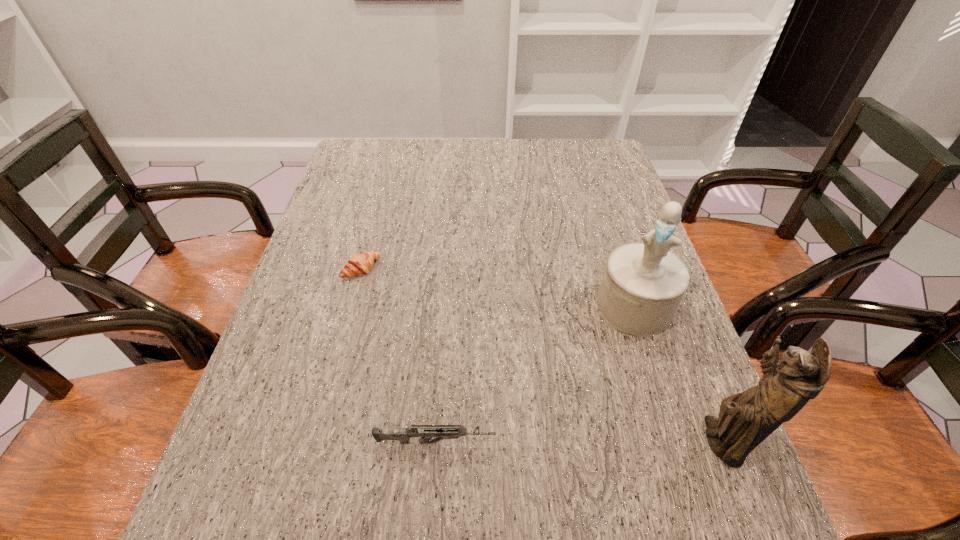
Where is `the third object from right to left`? the third object from right to left is located at coordinates (425, 432).

Identify the location of the second shortest object. The width and height of the screenshot is (960, 540). (425, 432).

Identify the location of the nearer figurine. (745, 419).

The image size is (960, 540). What are the coordinates of `the farther figurine` in the screenshot? It's located at (643, 284).

Locate an element on the screen. The width and height of the screenshot is (960, 540). pastry is located at coordinates (358, 265).

Identify the location of the leftmost object. (358, 265).

You are a GUI agent. You are given a task and a screenshot of the screen. Output one action in this format:
    pyautogui.click(x=<x>, y=<y>)
    Task: Click on the vacant space located aimed along the barrel of the second shortest object
    This screenshot has height=540, width=960.
    Given the screenshot: What is the action you would take?
    pyautogui.click(x=655, y=442)

This screenshot has height=540, width=960. Find the location of `free point located 0.280m on the front-facing side of the nearer figurine`. free point located 0.280m on the front-facing side of the nearer figurine is located at coordinates (534, 441).

Where is `vacant space situated 0.080m on the front-facing side of the nearer figurine`? vacant space situated 0.080m on the front-facing side of the nearer figurine is located at coordinates (643, 441).

Find the location of a particular element. This screenshot has height=540, width=960. free space located on the front-facing side of the nearer figurine is located at coordinates (594, 441).